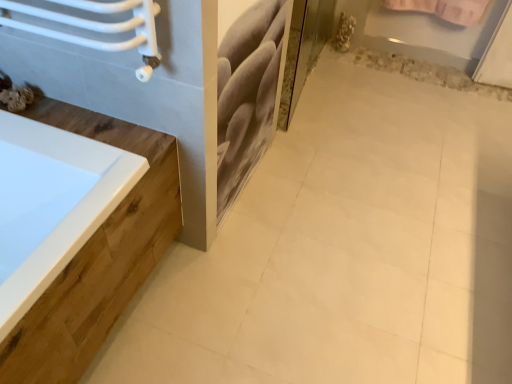
Question: Considering the relative sizes of clear glass screen door at upper center and white glossy ceramic tile at center in the image provided, is clear glass screen door at upper center bigger than white glossy ceramic tile at center?

Choices:
 (A) yes
 (B) no

Answer: (B)

Question: From a real-world perspective, is clear glass screen door at upper center located beneath white glossy ceramic tile at center?

Choices:
 (A) yes
 (B) no

Answer: (B)

Question: Would you consider clear glass screen door at upper center to be distant from white glossy ceramic tile at center?

Choices:
 (A) yes
 (B) no

Answer: (B)

Question: From the image's perspective, would you say clear glass screen door at upper center is positioned over white glossy ceramic tile at center?

Choices:
 (A) yes
 (B) no

Answer: (A)

Question: Is white glossy ceramic tile at center located within clear glass screen door at upper center?

Choices:
 (A) yes
 (B) no

Answer: (B)

Question: Is clear glass screen door at upper center shorter than white glossy ceramic tile at center?

Choices:
 (A) no
 (B) yes

Answer: (A)

Question: Is clear glass screen door at upper center at the back of white glossy ceramic tile at center?

Choices:
 (A) yes
 (B) no

Answer: (B)

Question: Is the position of white glossy ceramic tile at center more distant than that of clear glass screen door at upper center?

Choices:
 (A) yes
 (B) no

Answer: (B)

Question: Is white glossy ceramic tile at center closer to the viewer compared to clear glass screen door at upper center?

Choices:
 (A) yes
 (B) no

Answer: (A)

Question: Can you confirm if white glossy ceramic tile at center is wider than clear glass screen door at upper center?

Choices:
 (A) yes
 (B) no

Answer: (A)

Question: Considering the relative positions of white glossy ceramic tile at center and clear glass screen door at upper center in the image provided, is white glossy ceramic tile at center to the right of clear glass screen door at upper center from the viewer's perspective?

Choices:
 (A) no
 (B) yes

Answer: (B)

Question: From the image's perspective, is white glossy ceramic tile at center on top of clear glass screen door at upper center?

Choices:
 (A) no
 (B) yes

Answer: (A)

Question: Does point (281, 109) appear closer or farther from the camera than point (367, 342)?

Choices:
 (A) closer
 (B) farther

Answer: (B)